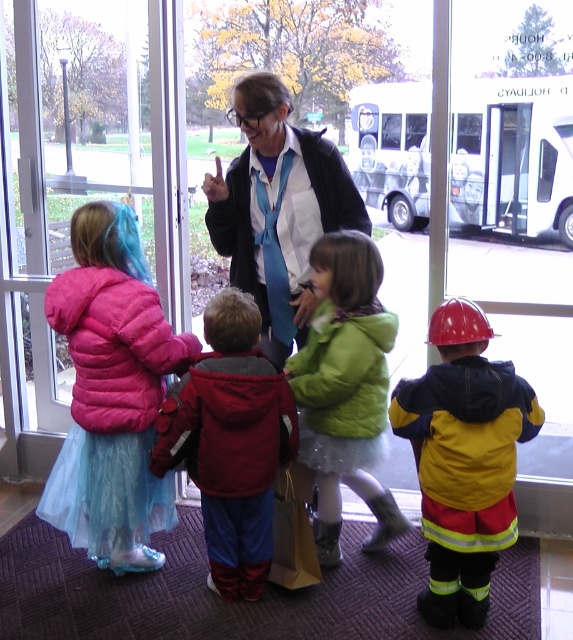
Question: Does red fleece jacket at center have a greater width compared to green fuzzy jacket at center?

Choices:
 (A) yes
 (B) no

Answer: (A)

Question: Can you confirm if puffy pink fabric dress at left is bigger than matte blue tie at center?

Choices:
 (A) yes
 (B) no

Answer: (B)

Question: Which point is closer to the camera?

Choices:
 (A) (150, 388)
 (B) (237, 573)

Answer: (A)

Question: Is puffy pink fabric dress at left wider than yellow matte jacket at center?

Choices:
 (A) yes
 (B) no

Answer: (A)

Question: Which object is closer to the camera taking this photo?

Choices:
 (A) puffy pink fabric dress at left
 (B) red fleece jacket at center
 (C) yellow matte jacket at center
 (D) green fuzzy jacket at center

Answer: (C)

Question: Which point is closer to the camera?

Choices:
 (A) puffy pink fabric dress at left
 (B) green fuzzy jacket at center

Answer: (B)